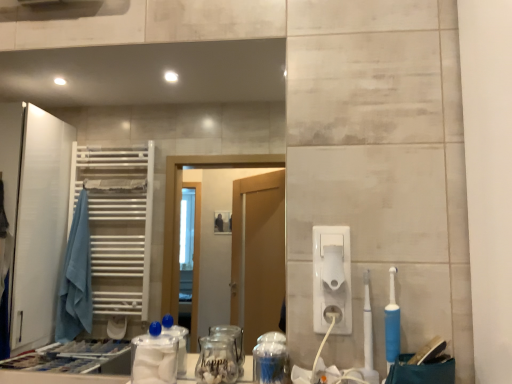
Question: Should I look upward or downward to see transparent glass jar at center, which appears as the 1th glass jar when viewed from the right?

Choices:
 (A) down
 (B) up

Answer: (A)

Question: Does transparent plastic container at center come behind white plastic toothbrush at right, placed as the 2th toothbrush when sorted from right to left?

Choices:
 (A) no
 (B) yes

Answer: (B)

Question: Is transparent plastic container at center bigger than white plastic toothbrush at right, the first toothbrush from the left?

Choices:
 (A) yes
 (B) no

Answer: (A)

Question: From the image's perspective, is transparent plastic container at center above white plastic toothbrush at right, placed as the 2th toothbrush when sorted from right to left?

Choices:
 (A) no
 (B) yes

Answer: (A)

Question: Is transparent plastic container at center facing towards white plastic toothbrush at right, the first toothbrush from the left?

Choices:
 (A) yes
 (B) no

Answer: (B)

Question: From the image's perspective, is transparent plastic container at center under white plastic toothbrush at right, the first toothbrush from the left?

Choices:
 (A) no
 (B) yes

Answer: (B)

Question: Can you confirm if transparent plastic container at center is positioned to the left of white plastic toothbrush at right, the first toothbrush from the left?

Choices:
 (A) yes
 (B) no

Answer: (A)

Question: Is white plastic toilet paper at center-right bigger than transparent glass jar at center, which is the 2th glass jar in left-to-right order?

Choices:
 (A) yes
 (B) no

Answer: (B)

Question: From a real-world perspective, is white plastic toilet paper at center-right physically below transparent glass jar at center, which appears as the 1th glass jar when viewed from the right?

Choices:
 (A) yes
 (B) no

Answer: (B)

Question: Are white plastic toilet paper at center-right and transparent glass jar at center, which is the 2th glass jar in left-to-right order, making contact?

Choices:
 (A) yes
 (B) no

Answer: (B)

Question: From the image's perspective, is white plastic toilet paper at center-right below transparent glass jar at center, which is the 2th glass jar in left-to-right order?

Choices:
 (A) no
 (B) yes

Answer: (A)

Question: Does white plastic toilet paper at center-right have a smaller size compared to transparent glass jar at center, which appears as the 1th glass jar when viewed from the right?

Choices:
 (A) no
 (B) yes

Answer: (B)

Question: Is white plastic toilet paper at center-right wider than transparent glass jar at center, which appears as the 1th glass jar when viewed from the right?

Choices:
 (A) no
 (B) yes

Answer: (A)

Question: Does white plastic toilet paper at center-right have a lesser height compared to transparent glass jar at center, the 1th glass jar viewed from the left?

Choices:
 (A) no
 (B) yes

Answer: (B)